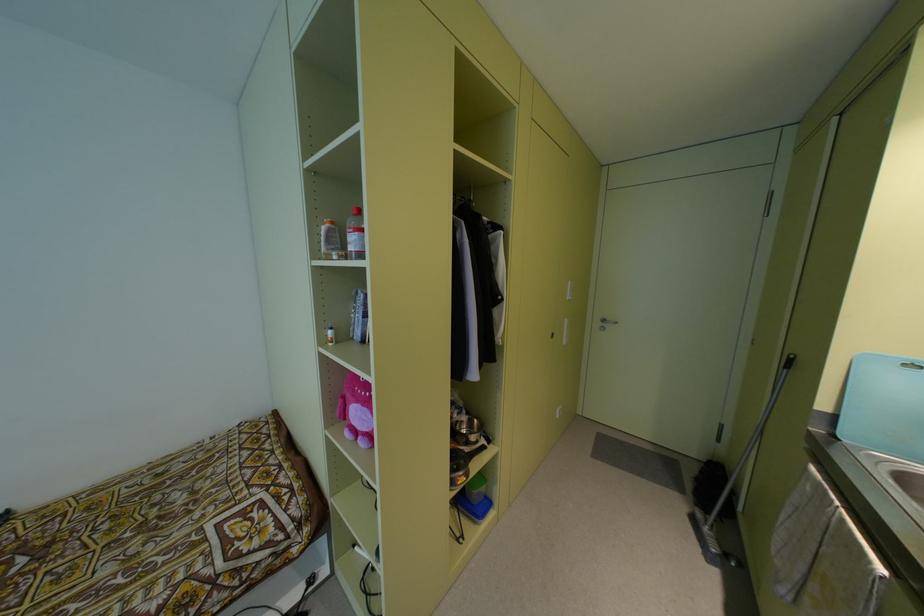
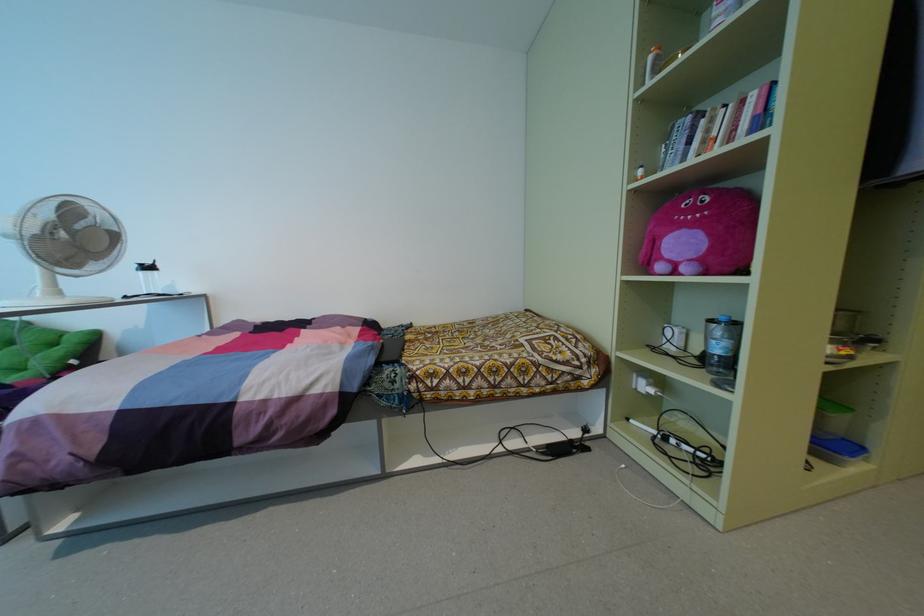
Question: The first image is from the beginning of the video and the second image is from the end. How did the camera likely rotate when shooting the video?

Choices:
 (A) Left
 (B) Right
 (C) Up
 (D) Down

Answer: (A)